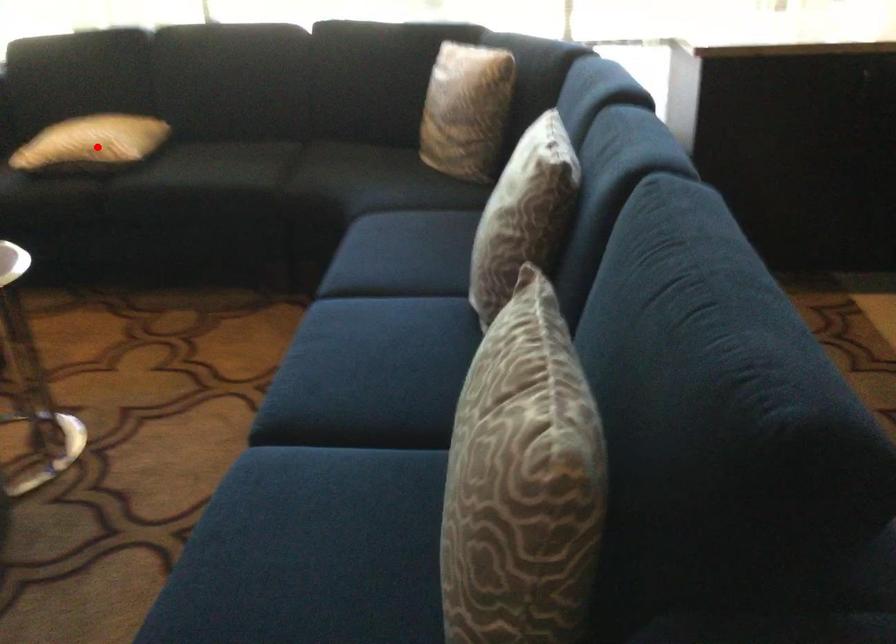
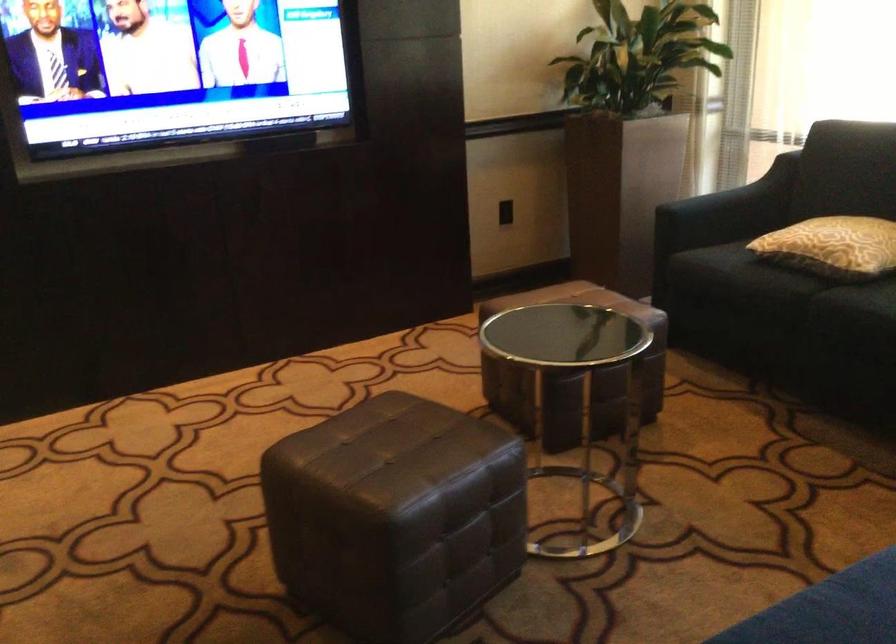
The point at the highlighted location is marked in the first image. Where is the corresponding point in the second image?

(832, 245)